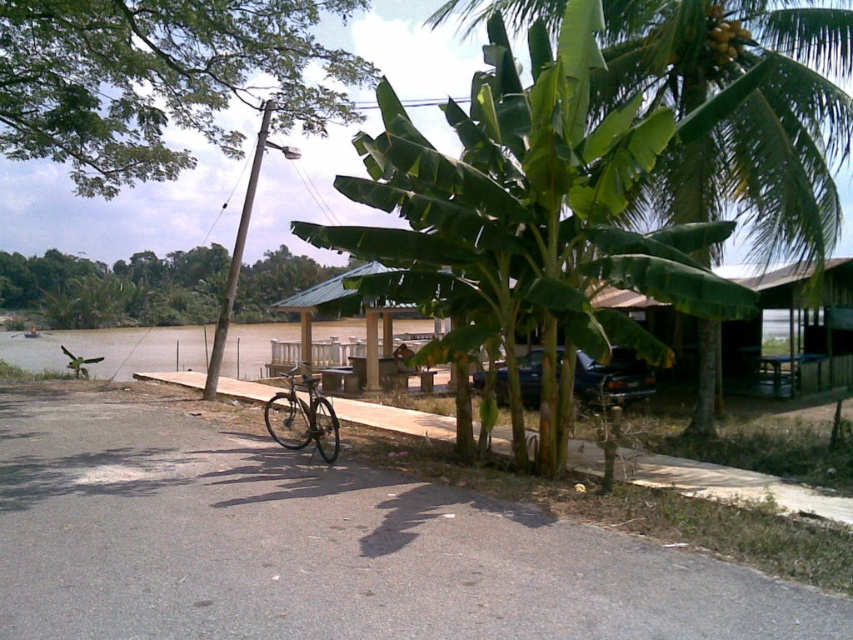
Can you confirm if green leafy banana tree at center is wider than green leafy tree at upper left?

In fact, green leafy banana tree at center might be narrower than green leafy tree at upper left.

Who is more distant from viewer, (x=509, y=1) or (x=9, y=86)?

The point (x=9, y=86) is behind.

Image resolution: width=853 pixels, height=640 pixels. I want to click on green leafy banana tree at center, so click(741, 115).

Who is taller, shiny metallic bicycle at center or yellow-green textured bananas at upper right?

With more height is yellow-green textured bananas at upper right.

Who is more forward, (289, 429) or (749, 42)?

Point (289, 429) is more forward.

The image size is (853, 640). I want to click on shiny metallic bicycle at center, so click(305, 417).

Looking at this image, which of these two, green leafy tree at center or shiny metallic bicycle at center, stands shorter?

shiny metallic bicycle at center

Is green leafy tree at center to the right of shiny metallic bicycle at center from the viewer's perspective?

No, green leafy tree at center is not to the right of shiny metallic bicycle at center.

Who is more distant from viewer, (57,269) or (265,422)?

The point (57,269) is behind.

Find the location of a particular element. The height and width of the screenshot is (640, 853). green leafy tree at center is located at coordinates (115, 285).